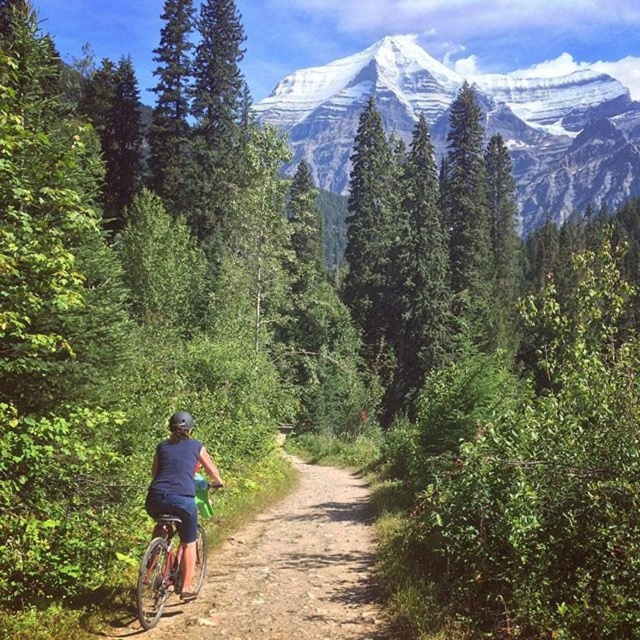
You are a hiker standing at the starting point of the dirt path where the cyclist is riding. You want to reach the snowy granite mountain at upper center. The path is narrow and has a steep incline. If the path is 1,000 feet long, will you be able to reach the mountain before the path ends?

The snowy granite mountain at upper center is 988.76 feet from the viewer. Since the path is 1,000 feet long, you will be able to reach the mountain before the path ends because the distance to the mountain is shorter than the path length.

Based on the photo, you are standing at the starting point of the dirt path and want to reach the end of the path. Which direction should you move first if you want to go towards the point that is closer to you? The points you can choose are point A at point [515,116] and point B at point [170,422].

You should move towards point B at point [170,422] first because it is closer to you than point A at point [515,116].

What is the exact coordinate of the snowy granite mountain at upper center?

The snowy granite mountain at upper center is located at point [483,118].